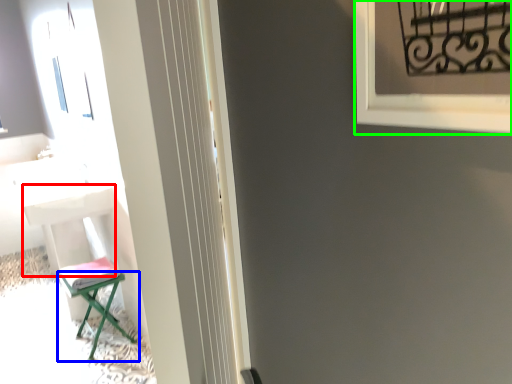
Question: Which object is the farthest from table (highlighted by a red box)? Choose among these: furniture (highlighted by a blue box) or window frame (highlighted by a green box).

Choices:
 (A) furniture
 (B) window frame

Answer: (B)